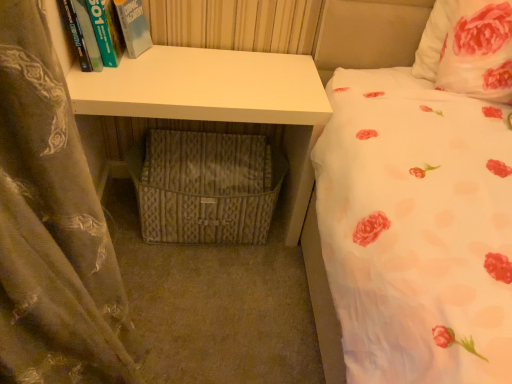
Identify the location of vacant area located to the right-hand side of hardcover book at upper left. (175, 67).